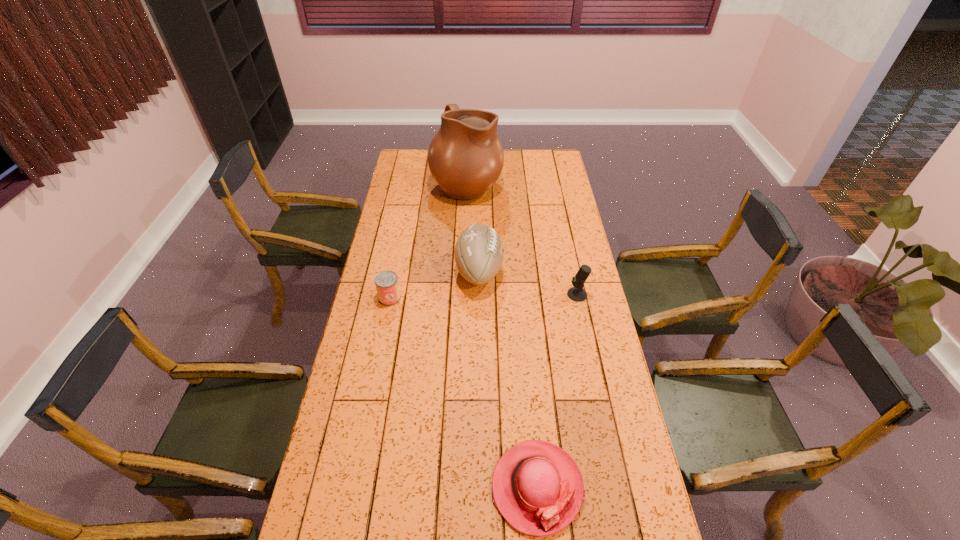
Find the location of a particular element. The image size is (960, 540). blank region between the third tallest object and the hat is located at coordinates (557, 391).

At what (x,y) coordinates should I click in order to perform the action: click on free space between the cream pitcher and the hat. Please return your answer as a coordinate pair (x, y). Looking at the image, I should click on 502,335.

Where is `unoccupied area between the rightmost object and the second tallest object`? unoccupied area between the rightmost object and the second tallest object is located at coordinates (528, 282).

Locate an element on the screen. The image size is (960, 540). vacant region between the rightmost object and the can is located at coordinates (484, 296).

Find the location of a particular element. The height and width of the screenshot is (540, 960). empty space between the tallest object and the rightmost object is located at coordinates (522, 239).

Image resolution: width=960 pixels, height=540 pixels. Identify the location of vacant space in between the hat and the rightmost object. (557, 391).

Locate which object ranks in proximity to the hat. Please provide its 2D coordinates. Your answer should be formatted as a tuple, i.e. [(x, y)], where the tuple contains the x and y coordinates of a point satisfying the conditions above.

[(577, 293)]

At what (x,y) coordinates should I click in order to perform the action: click on object that ranks as the third closest to the third shortest object. Please return your answer as a coordinate pair (x, y). Looking at the image, I should click on (465, 157).

Find the location of a particular element. Image resolution: width=960 pixels, height=540 pixels. free spot that satisfies the following two spatial constraints: 1. on the laces of the football (American); 2. on the left side of the third tallest object is located at coordinates (479, 294).